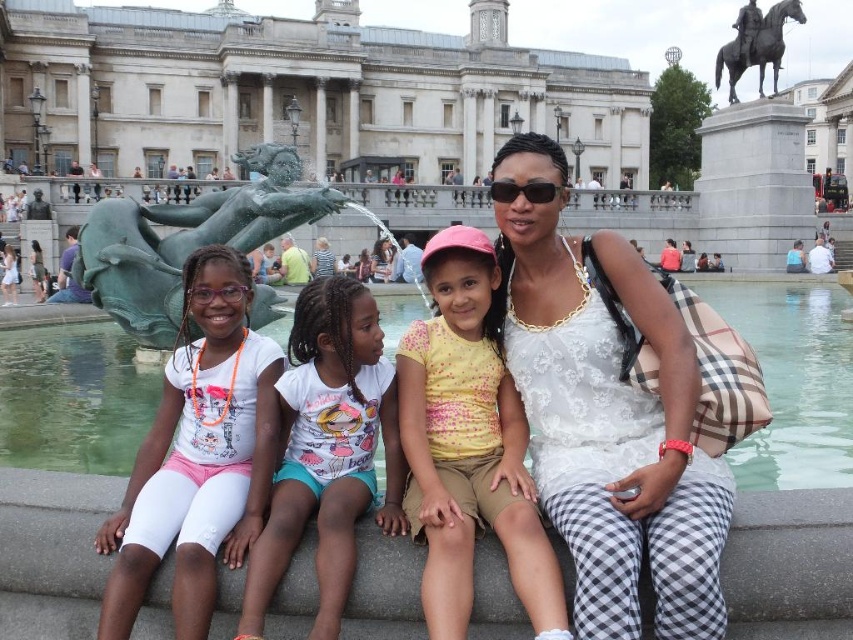
You are a photographer trying to capture both the yellow dotted shirt at center and the green patina bronze mermaid at center in the same frame. Since you want to ensure both are clearly visible, which object should you focus on first to account for their sizes?

The yellow dotted shirt at center has a lesser width compared to the green patina bronze mermaid at center, so you should focus on the green patina bronze mermaid at center first since it is larger and might require more attention to capture details properly.

You are standing at the point labeled point (x=311, y=216) and want to walk to the fountain located at the center of the image. There is an obstacle at point (x=526, y=342). Can you walk directly towards the fountain without going around the obstacle?

Since point (x=526, y=342) is in front of point (x=311, y=216), walking directly towards the fountain would require passing behind the obstacle at point (x=526, y=342), so you would need to go around it.